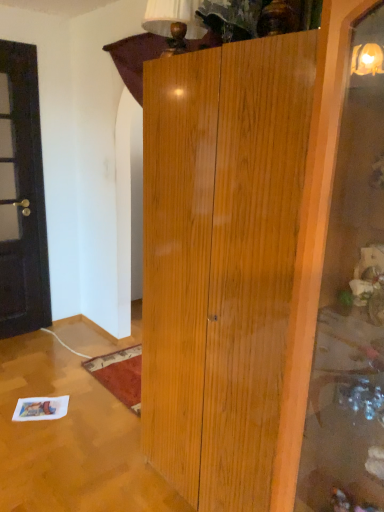
Question: Can you confirm if dark brown wooden door at left is bigger than matte brown lampshade at upper center?

Choices:
 (A) no
 (B) yes

Answer: (B)

Question: Is dark brown wooden door at left at the right side of matte brown lampshade at upper center?

Choices:
 (A) yes
 (B) no

Answer: (B)

Question: Could you tell me if dark brown wooden door at left is facing matte brown lampshade at upper center?

Choices:
 (A) no
 (B) yes

Answer: (B)

Question: Is dark brown wooden door at left positioned far away from matte brown lampshade at upper center?

Choices:
 (A) no
 (B) yes

Answer: (B)

Question: Is dark brown wooden door at left completely or partially outside of matte brown lampshade at upper center?

Choices:
 (A) yes
 (B) no

Answer: (A)

Question: Does dark brown wooden door at left lie behind matte brown lampshade at upper center?

Choices:
 (A) no
 (B) yes

Answer: (B)

Question: Is matte brown lampshade at upper center turned away from dark brown wooden door at left?

Choices:
 (A) no
 (B) yes

Answer: (A)

Question: Is the position of matte brown lampshade at upper center less distant than that of dark brown wooden door at left?

Choices:
 (A) no
 (B) yes

Answer: (B)

Question: From the image's perspective, is matte brown lampshade at upper center located beneath dark brown wooden door at left?

Choices:
 (A) no
 (B) yes

Answer: (A)

Question: Is matte brown lampshade at upper center smaller than dark brown wooden door at left?

Choices:
 (A) no
 (B) yes

Answer: (B)

Question: Can you confirm if matte brown lampshade at upper center is positioned to the right of dark brown wooden door at left?

Choices:
 (A) yes
 (B) no

Answer: (A)

Question: Does matte brown lampshade at upper center have a greater width compared to dark brown wooden door at left?

Choices:
 (A) yes
 (B) no

Answer: (A)

Question: From the image's perspective, is dark brown wooden door at left above or below matte brown lampshade at upper center?

Choices:
 (A) above
 (B) below

Answer: (B)